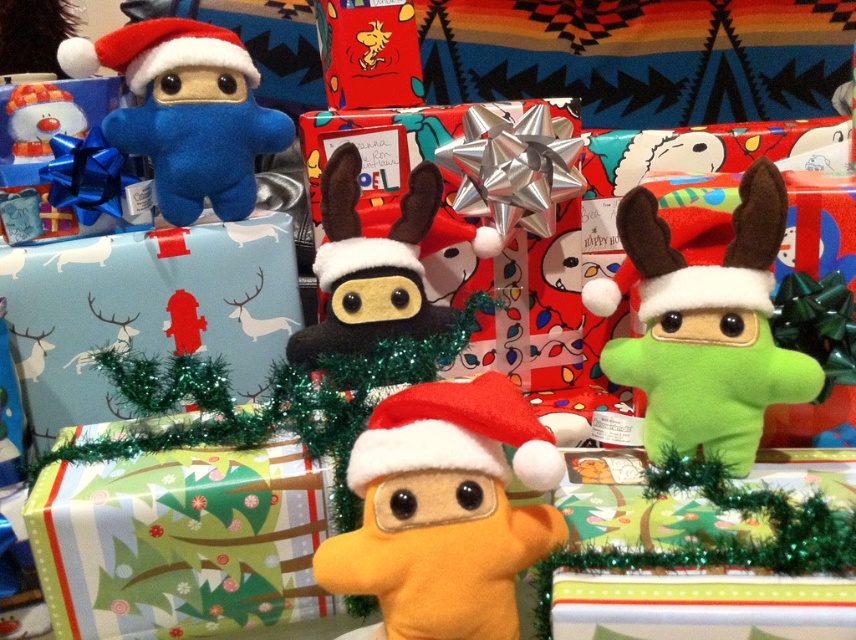
Question: Where is orange felt toy at center located in relation to red felt santa hat at center in the image?

Choices:
 (A) right
 (B) left

Answer: (A)

Question: Among these objects, which one is farthest from the camera?

Choices:
 (A) orange felt toy at center
 (B) felt ninja at center
 (C) red plush santa hat at upper left
 (D) matte blue plush at upper left

Answer: (D)

Question: Is orange felt toy at center below red plush santa hat at upper left?

Choices:
 (A) no
 (B) yes

Answer: (B)

Question: Is matte blue plush at upper left thinner than red felt santa hat at center?

Choices:
 (A) yes
 (B) no

Answer: (B)

Question: Estimate the real-world distances between objects in this image. Which object is farther from the felt ninja at center?

Choices:
 (A) red felt santa hat at center
 (B) matte blue plush at upper left

Answer: (A)

Question: Which object appears closest to the camera in this image?

Choices:
 (A) matte blue plush toy at upper left
 (B) matte blue plush at upper left

Answer: (B)